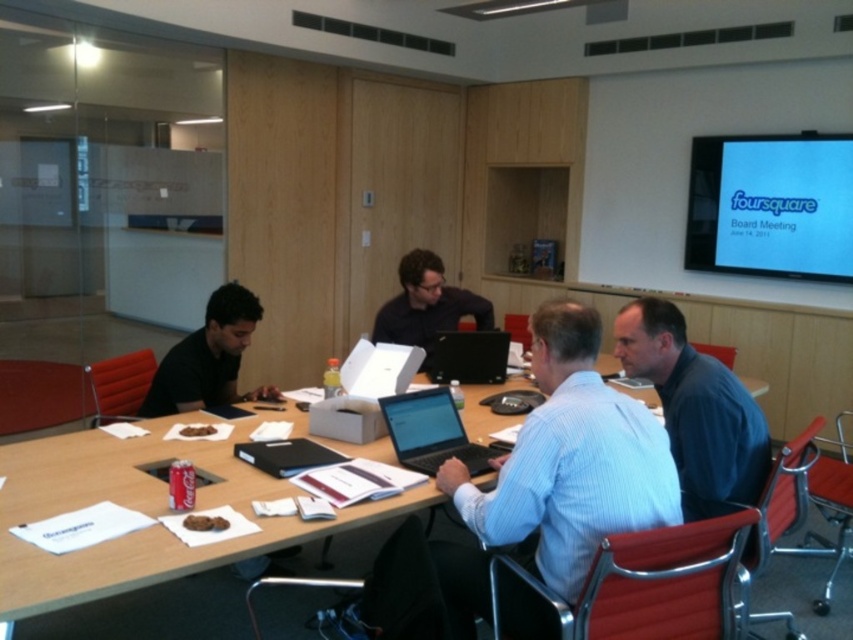
Question: Is wooden table at center above matte black laptop at center?

Choices:
 (A) yes
 (B) no

Answer: (B)

Question: Which object appears closest to the camera in this image?

Choices:
 (A) black matte laptop at center
 (B) matte black laptop at center

Answer: (B)

Question: Is silver metallic laptop at center thinner than black matte laptop at center?

Choices:
 (A) no
 (B) yes

Answer: (A)

Question: Is wooden table at center positioned behind black matte laptop at center?

Choices:
 (A) no
 (B) yes

Answer: (A)

Question: Which point appears closest to the camera in this image?

Choices:
 (A) (136, 550)
 (B) (401, 419)
 (C) (759, 451)

Answer: (A)

Question: Among these points, which one is nearest to the camera?

Choices:
 (A) (451, 348)
 (B) (387, 400)
 (C) (675, 408)

Answer: (C)